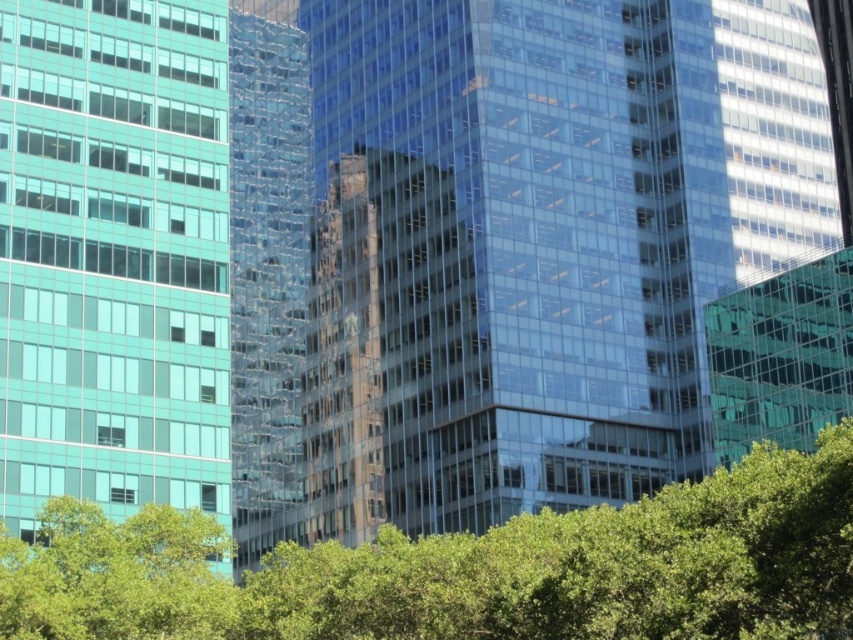
Question: Which point is closer to the camera?

Choices:
 (A) (770, 577)
 (B) (22, 410)

Answer: (A)

Question: Which object is positioned farthest from the teal glass building at left?

Choices:
 (A) transparent glass building at center
 (B) green leafy tree at lower center

Answer: (A)

Question: Which object is positioned farthest from the green leafy tree at lower center?

Choices:
 (A) teal glass building at left
 (B) transparent glass building at center

Answer: (B)

Question: Is teal glass building at left to the right of green leafy tree at lower center from the viewer's perspective?

Choices:
 (A) yes
 (B) no

Answer: (B)

Question: Can you confirm if teal glass building at left is positioned below green leafy tree at lower center?

Choices:
 (A) no
 (B) yes

Answer: (A)

Question: Does transparent glass building at center have a larger size compared to green leafy tree at lower center?

Choices:
 (A) no
 (B) yes

Answer: (B)